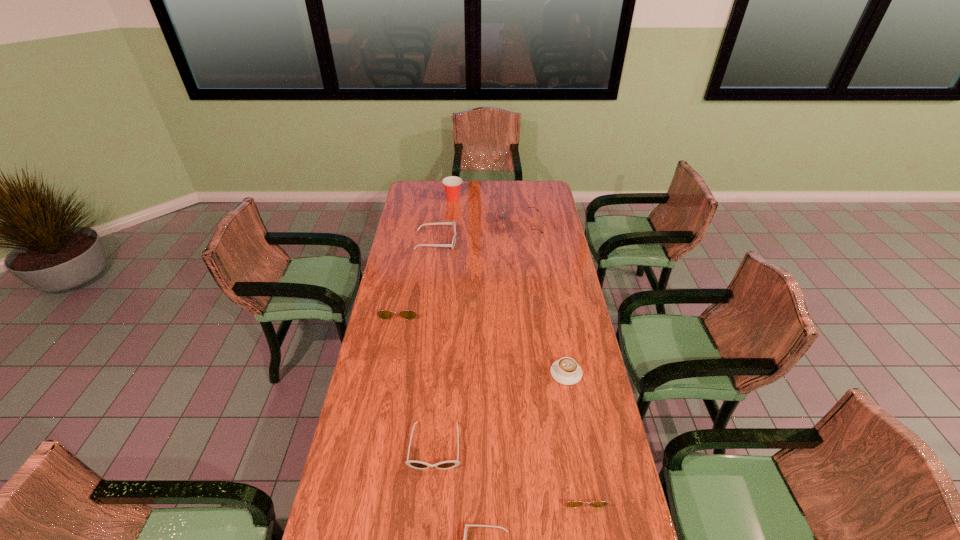
The width and height of the screenshot is (960, 540). Find the location of `blank region between the second farthest black sunglasses and the leftmost green sunglasses`. blank region between the second farthest black sunglasses and the leftmost green sunglasses is located at coordinates (418, 376).

Locate an element on the screen. This screenshot has width=960, height=540. object identified as the closest to the second nearest black sunglasses is located at coordinates (465, 531).

Locate which object is the seventh closest to the farthest black sunglasses. Please provide its 2D coordinates. Your answer should be formatted as a tuple, i.e. [(x, y)], where the tuple contains the x and y coordinates of a point satisfying the conditions above.

[(465, 531)]

Image resolution: width=960 pixels, height=540 pixels. In order to click on sunglasses identified as the fifth closest to the farthest green sunglasses in this screenshot , I will do pos(465,531).

The image size is (960, 540). Identify the location of sunglasses that stands as the second closest to the smallest green sunglasses. (444, 465).

Select which green sunglasses appears as the closest to the tallest object. Please provide its 2D coordinates. Your answer should be formatted as a tuple, i.e. [(x, y)], where the tuple contains the x and y coordinates of a point satisfying the conditions above.

[(503, 217)]

At what (x,y) coordinates should I click in order to perform the action: click on green sunglasses that stands as the closest to the biggest green sunglasses. Please return your answer as a coordinate pair (x, y). The width and height of the screenshot is (960, 540). Looking at the image, I should click on (382, 314).

Locate an element on the screen. Image resolution: width=960 pixels, height=540 pixels. the second closest black sunglasses to the smallest green sunglasses is located at coordinates tap(444, 465).

Locate an element on the screen. The image size is (960, 540). black sunglasses that stands as the second closest to the smallest black sunglasses is located at coordinates (452, 245).